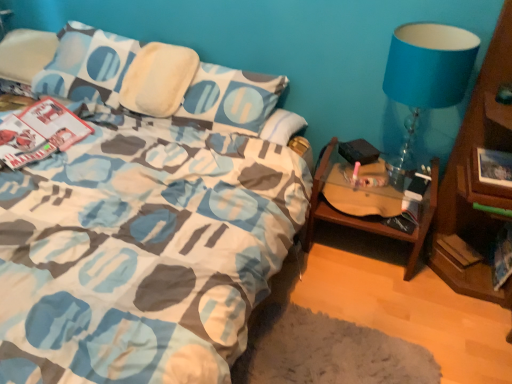
Locate an element on the screen. The height and width of the screenshot is (384, 512). free point below woodenobject at right (from a real-world perspective) is located at coordinates (360, 244).